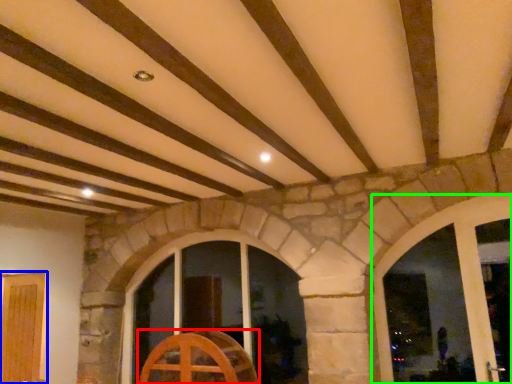
Question: Which object is positioned farthest from furniture (highlighted by a red box)? Select from door (highlighted by a blue box) and window (highlighted by a green box).

Choices:
 (A) door
 (B) window

Answer: (B)